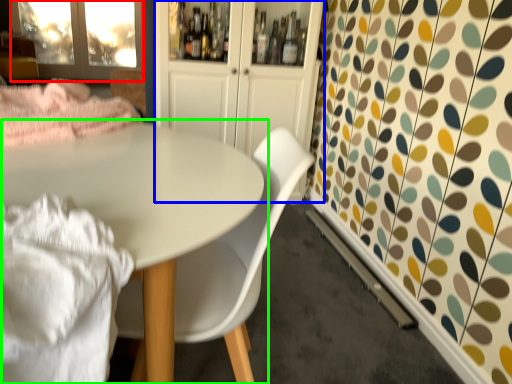
Question: Based on their relative distances, which object is nearer to screen door (highlighted by a red box)? Choose from dresser (highlighted by a blue box) and table (highlighted by a green box).

Choices:
 (A) dresser
 (B) table

Answer: (A)